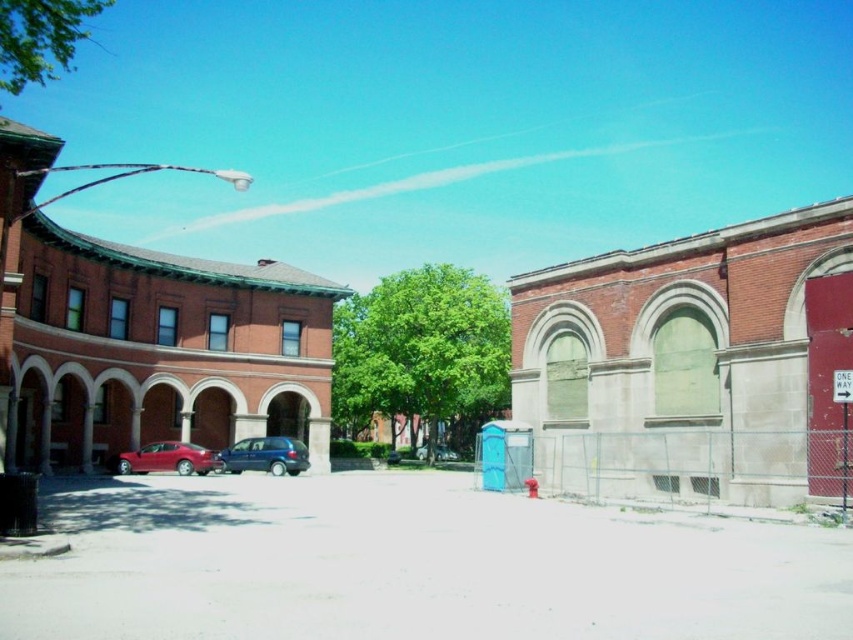
Question: Which point is closer to the camera taking this photo?

Choices:
 (A) (196, 454)
 (B) (454, 460)
 (C) (844, 397)

Answer: (C)

Question: Is white plastic street sign at right to the right of white plastic sign at upper right from the viewer's perspective?

Choices:
 (A) no
 (B) yes

Answer: (B)

Question: In this image, where is metallic blue minivan at center located relative to metallic blue sedan at center?

Choices:
 (A) above
 (B) below

Answer: (A)

Question: Based on their relative distances, which object is nearer to the metallic blue sedan at center?

Choices:
 (A) white plastic street sign at right
 (B) chain-link fence at lower right
 (C) metallic blue minivan at center
 (D) shiny red sedan at lower left

Answer: (C)

Question: Which object appears farthest from the camera in this image?

Choices:
 (A) shiny red sedan at lower left
 (B) metallic blue sedan at center

Answer: (B)

Question: Is chain-link fence at lower right positioned behind metallic blue sedan at center?

Choices:
 (A) yes
 (B) no

Answer: (B)